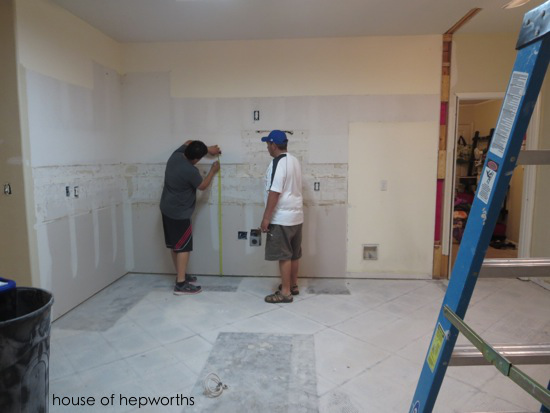
Where is `ceiling`? ceiling is located at coordinates (312, 24).